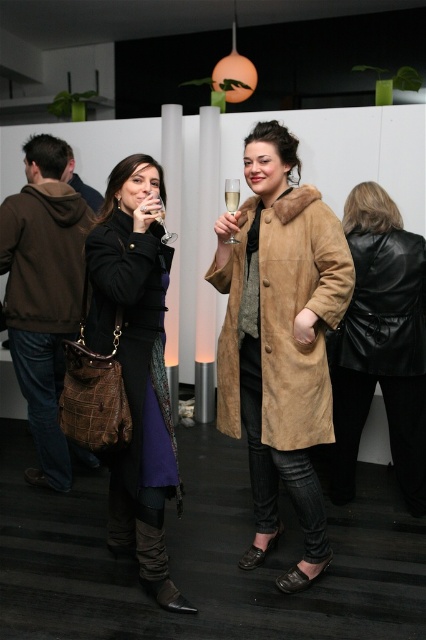
Question: Is black leather coat at center to the right of clear glass at upper center from the viewer's perspective?

Choices:
 (A) yes
 (B) no

Answer: (A)

Question: Which of the following is the closest to the observer?

Choices:
 (A) brown suede hoodie at left
 (B) clear glass at upper center

Answer: (B)

Question: Considering the real-world distances, which object is closest to the suede coat at center?

Choices:
 (A) clear glass wine glass at upper center
 (B) clear glass at upper center
 (C) black leather coat at center

Answer: (B)

Question: Which point is closer to the camera taking this photo?

Choices:
 (A) (23, 252)
 (B) (365, 397)
 (C) (95, 346)
 (D) (158, 220)

Answer: (D)

Question: Observing the image, what is the correct spatial positioning of black leather coat at center in reference to brown suede hoodie at left?

Choices:
 (A) right
 (B) left

Answer: (A)

Question: Observing the image, what is the correct spatial positioning of suede coat at center in reference to black leather coat at center?

Choices:
 (A) right
 (B) left

Answer: (B)